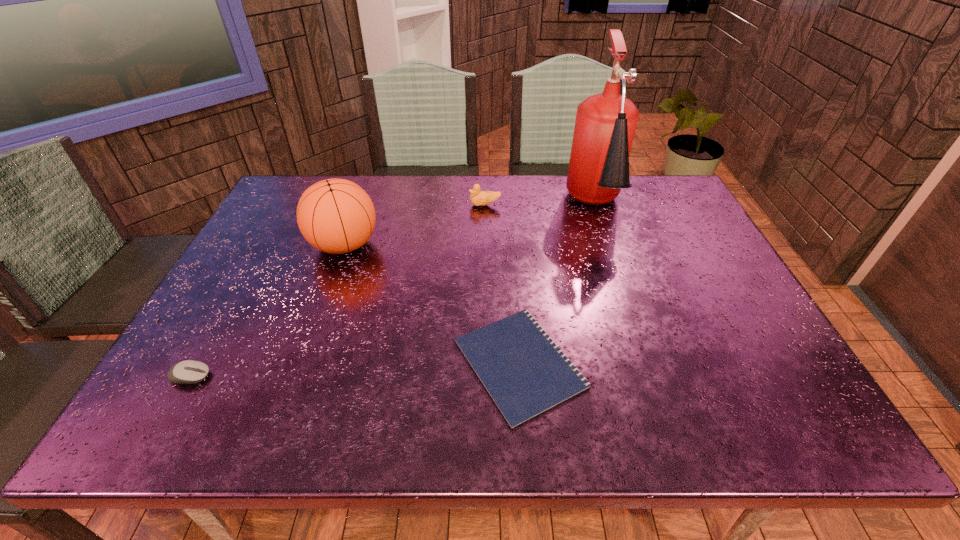
Locate an element on the screen. vacant area at the near edge is located at coordinates (447, 426).

In the image, there is a desktop. Where is `vacant area at the left edge`? vacant area at the left edge is located at coordinates (297, 255).

Locate an element on the screen. This screenshot has height=540, width=960. vacant space at the right edge is located at coordinates (744, 372).

Image resolution: width=960 pixels, height=540 pixels. Find the location of `free space at the far left corner of the desktop`. free space at the far left corner of the desktop is located at coordinates (284, 200).

At what (x,y) coordinates should I click in order to perform the action: click on free space at the near left corner of the desktop. Please return your answer as a coordinate pair (x, y). Looking at the image, I should click on (170, 404).

Locate an element on the screen. Image resolution: width=960 pixels, height=540 pixels. unoccupied position between the duckling and the leftmost object is located at coordinates (338, 291).

Where is `blank region between the fire extinguisher and the leftmost object`? blank region between the fire extinguisher and the leftmost object is located at coordinates (393, 292).

At what (x,y) coordinates should I click in order to perform the action: click on empty location between the computer equipment and the notepad. Please return your answer as a coordinate pair (x, y). The width and height of the screenshot is (960, 540). Looking at the image, I should click on (355, 370).

What are the coordinates of `vacant region between the fire extinguisher and the duckling` in the screenshot? It's located at (540, 206).

Find the location of a particular element. The image size is (960, 540). vacant area that lies between the fourth shortest object and the third shortest object is located at coordinates (415, 225).